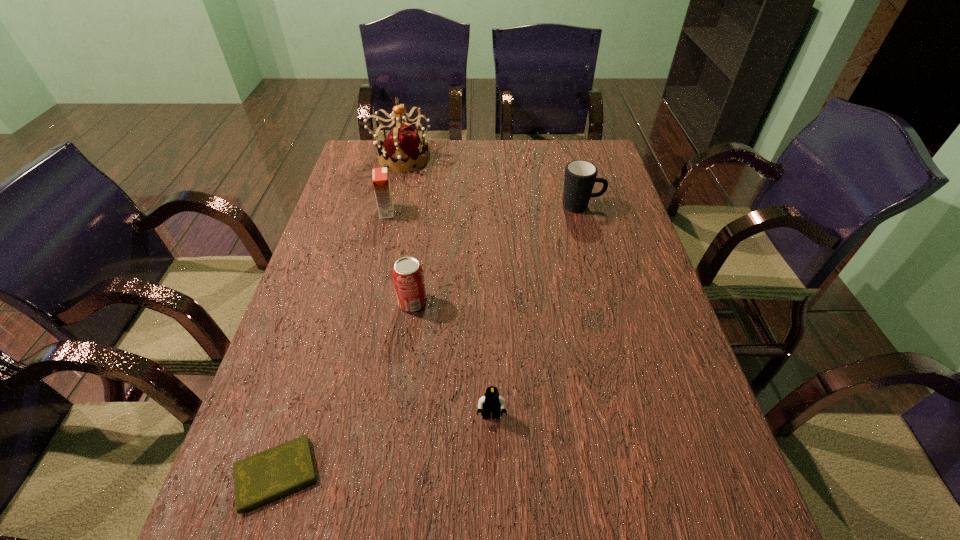
What are the coordinates of `tiara` in the screenshot? It's located at (402, 145).

The height and width of the screenshot is (540, 960). I want to click on the tallest object, so click(402, 145).

Locate an element on the screen. the rightmost object is located at coordinates (580, 176).

Where is `orange juice`? orange juice is located at coordinates click(x=381, y=183).

What are the coordinates of `the third nearest object` in the screenshot? It's located at (407, 273).

Locate an element on the screen. Image resolution: width=960 pixels, height=540 pixels. Lego is located at coordinates (492, 402).

The height and width of the screenshot is (540, 960). I want to click on the fifth farthest object, so click(x=492, y=402).

Locate an element on the screen. The height and width of the screenshot is (540, 960). the nearest object is located at coordinates (272, 473).

Image resolution: width=960 pixels, height=540 pixels. What are the coordinates of `diary` in the screenshot? It's located at (272, 473).

Find the location of a particular element. The width and height of the screenshot is (960, 540). free space located on the front-facing side of the farthest object is located at coordinates (538, 158).